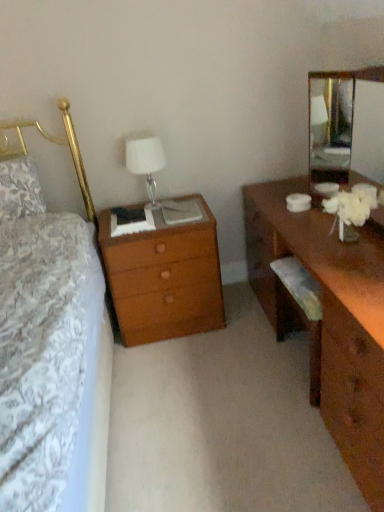
Question: Considering the relative positions of wooden nightstand at left and brown wooden desk at right in the image provided, is wooden nightstand at left to the left of brown wooden desk at right from the viewer's perspective?

Choices:
 (A) yes
 (B) no

Answer: (A)

Question: From the image's perspective, is wooden nightstand at left on top of brown wooden desk at right?

Choices:
 (A) yes
 (B) no

Answer: (B)

Question: Does wooden nightstand at left have a larger size compared to brown wooden desk at right?

Choices:
 (A) yes
 (B) no

Answer: (B)

Question: Does wooden nightstand at left turn towards brown wooden desk at right?

Choices:
 (A) no
 (B) yes

Answer: (A)

Question: Can you see wooden nightstand at left touching brown wooden desk at right?

Choices:
 (A) no
 (B) yes

Answer: (A)

Question: Is wooden nightstand at left closer to the viewer compared to brown wooden desk at right?

Choices:
 (A) no
 (B) yes

Answer: (A)

Question: Is clear glass mirror at upper right located outside wooden nightstand at left?

Choices:
 (A) no
 (B) yes

Answer: (B)

Question: Can you confirm if clear glass mirror at upper right is positioned to the left of wooden nightstand at left?

Choices:
 (A) no
 (B) yes

Answer: (A)

Question: Does clear glass mirror at upper right have a smaller size compared to wooden nightstand at left?

Choices:
 (A) no
 (B) yes

Answer: (B)

Question: Is the position of clear glass mirror at upper right more distant than that of wooden nightstand at left?

Choices:
 (A) yes
 (B) no

Answer: (B)

Question: From the image's perspective, is clear glass mirror at upper right located beneath wooden nightstand at left?

Choices:
 (A) no
 (B) yes

Answer: (A)

Question: Considering the relative sizes of clear glass mirror at upper right and wooden nightstand at left in the image provided, is clear glass mirror at upper right wider than wooden nightstand at left?

Choices:
 (A) no
 (B) yes

Answer: (A)

Question: Would you consider clear glass mirror at upper right to be distant from white fabric lampshade at upper center?

Choices:
 (A) yes
 (B) no

Answer: (A)